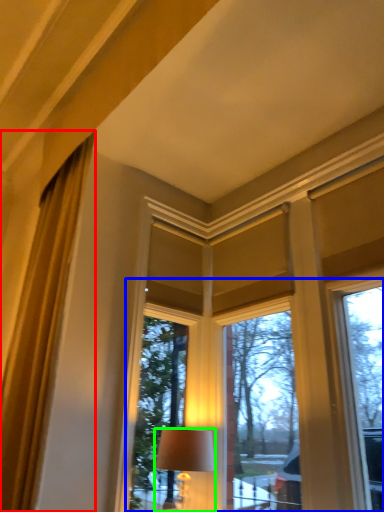
Question: Considering the real-world distances, which object is farthest from curtain (highlighted by a red box)? bay window (highlighted by a blue box) or lamp (highlighted by a green box)?

Choices:
 (A) bay window
 (B) lamp

Answer: (A)